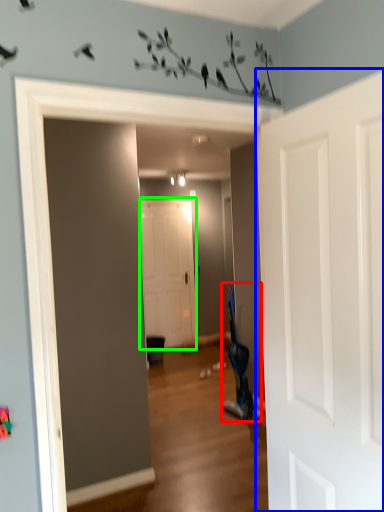
Question: Which object is the farthest from swivel chair (highlighted by a red box)? Choose among these: door (highlighted by a blue box) or door (highlighted by a green box).

Choices:
 (A) door
 (B) door

Answer: (A)